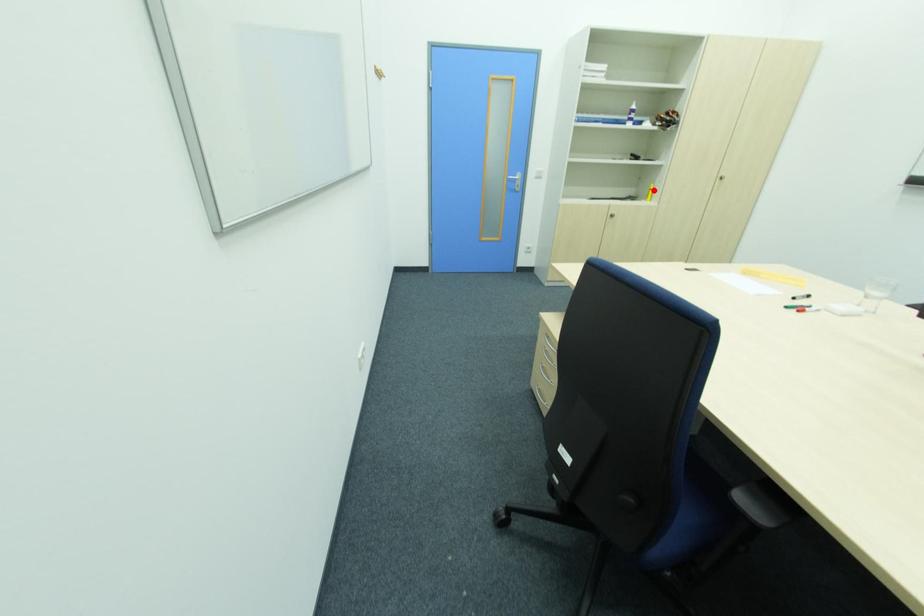
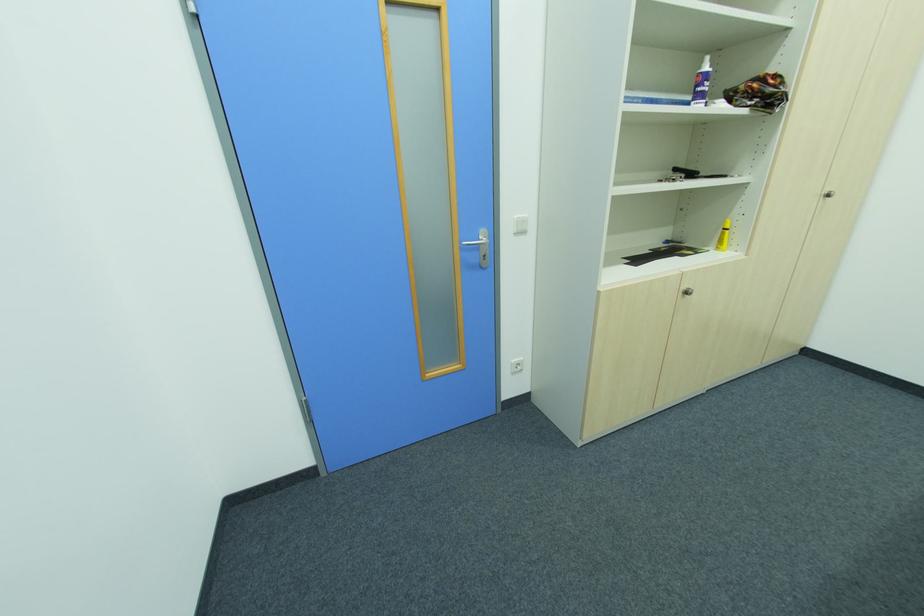
The point at the highlighted location is marked in the first image. Where is the corresponding point in the second image?

(728, 230)